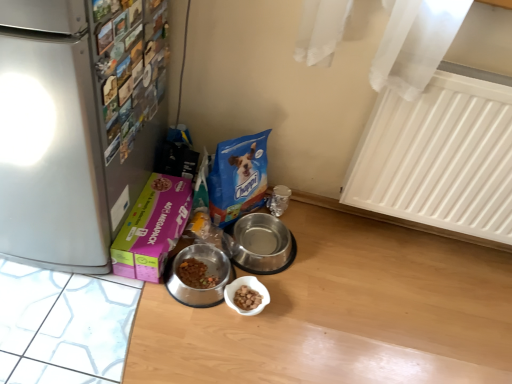
Question: From a real-world perspective, is white plastic radiator at upper right positioned over silver metallic bowl at center, acting as the first appliance starting from the right, based on gravity?

Choices:
 (A) no
 (B) yes

Answer: (B)

Question: Would you say silver metallic bowl at center, the 2th appliance from the left, is part of white plastic radiator at upper right's contents?

Choices:
 (A) yes
 (B) no

Answer: (B)

Question: Can you confirm if white plastic radiator at upper right is bigger than silver metallic bowl at center, the 2th appliance from the left?

Choices:
 (A) yes
 (B) no

Answer: (A)

Question: Is white plastic radiator at upper right turned away from silver metallic bowl at center, acting as the first appliance starting from the right?

Choices:
 (A) no
 (B) yes

Answer: (A)

Question: Considering the relative sizes of white plastic radiator at upper right and silver metallic bowl at center, the 2th appliance from the left, in the image provided, is white plastic radiator at upper right smaller than silver metallic bowl at center, the 2th appliance from the left,?

Choices:
 (A) no
 (B) yes

Answer: (A)

Question: From the image's perspective, would you say white plastic radiator at upper right is positioned over silver metallic bowl at center, acting as the first appliance starting from the right?

Choices:
 (A) yes
 (B) no

Answer: (A)

Question: From the image's perspective, is pink cardboard box at lower left above silver metallic bowl at center, the 2th appliance from the left?

Choices:
 (A) no
 (B) yes

Answer: (B)

Question: From a real-world perspective, is pink cardboard box at lower left positioned under silver metallic bowl at center, acting as the first appliance starting from the right, based on gravity?

Choices:
 (A) no
 (B) yes

Answer: (A)

Question: Is pink cardboard box at lower left bigger than silver metallic bowl at center, acting as the first appliance starting from the right?

Choices:
 (A) no
 (B) yes

Answer: (B)

Question: Is pink cardboard box at lower left at the left side of silver metallic bowl at center, acting as the first appliance starting from the right?

Choices:
 (A) no
 (B) yes

Answer: (B)

Question: Is pink cardboard box at lower left not near silver metallic bowl at center, the 2th appliance from the left?

Choices:
 (A) no
 (B) yes

Answer: (A)

Question: Does pink cardboard box at lower left have a greater width compared to silver metallic bowl at center, acting as the first appliance starting from the right?

Choices:
 (A) no
 (B) yes

Answer: (B)

Question: Considering the relative positions of white plastic radiator at upper right and metallic stainless steel bowl at center, arranged as the 2th appliance when viewed from the right, in the image provided, is white plastic radiator at upper right to the left of metallic stainless steel bowl at center, arranged as the 2th appliance when viewed from the right, from the viewer's perspective?

Choices:
 (A) yes
 (B) no

Answer: (B)